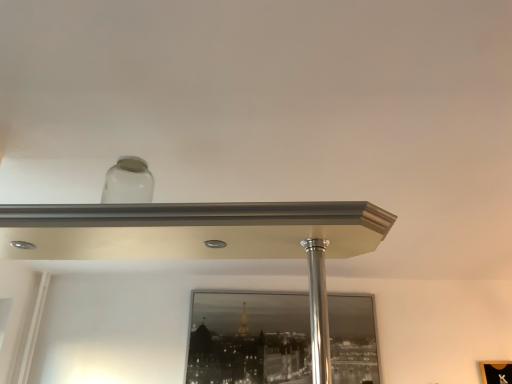
The height and width of the screenshot is (384, 512). What are the coordinates of `free location above black glass mirror at center (from a real-world perspective)` in the screenshot? It's located at (272, 292).